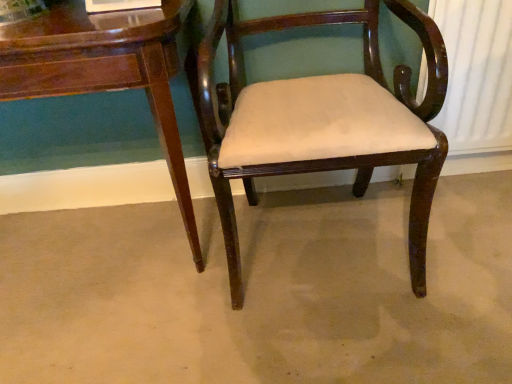
Find the location of a particular element. Image resolution: width=512 pixels, height=384 pixels. vacant space underneath glossy wood table at lower left (from a real-world perspective) is located at coordinates (92, 240).